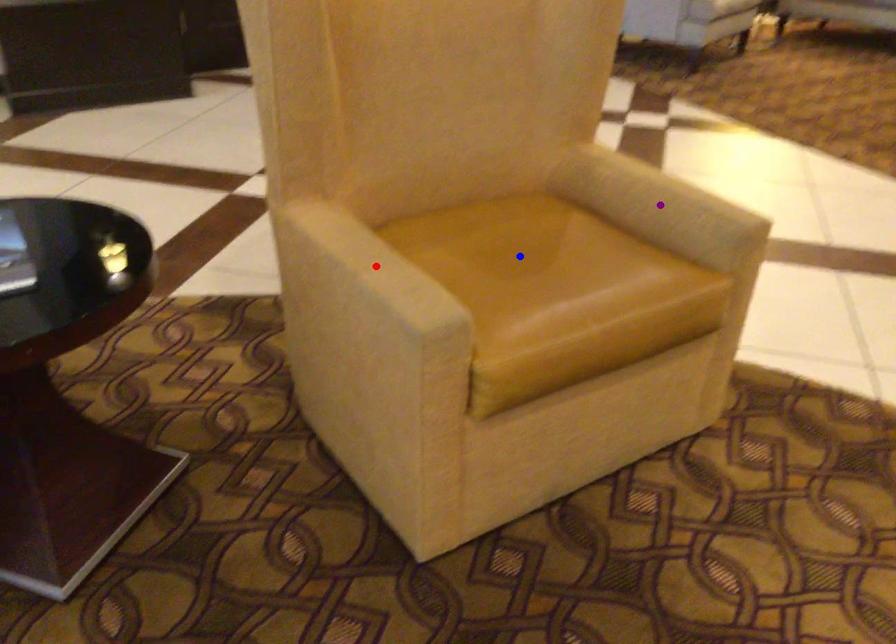
Order these from nearest to farthest:
1. red point
2. blue point
3. purple point

1. red point
2. blue point
3. purple point